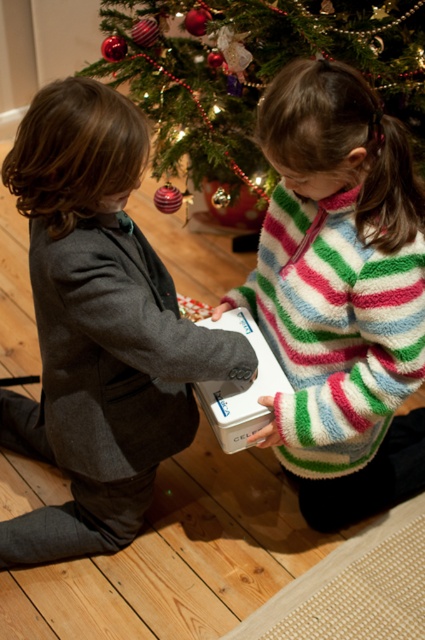
What are the coordinates of `dark gray suit at left` in the screenshot? It's located at (99, 326).

Between point (67, 198) and point (158, 145), which one is positioned behind?

Point (158, 145)

This screenshot has width=425, height=640. Identify the location of dark gray suit at left. (99, 326).

Measure the distance between white fluffy sweater at center and white matte box at center.

A distance of 7.39 inches exists between white fluffy sweater at center and white matte box at center.

Is point (325, 429) positioned behind point (255, 330)?

No, (325, 429) is closer to viewer.

This screenshot has width=425, height=640. In order to click on white fluffy sweater at center in this screenshot , I will do `click(340, 292)`.

Is white fluffy sweater at center taller than green textured christmas tree at upper center?

Indeed, white fluffy sweater at center has a greater height compared to green textured christmas tree at upper center.

Is point (393, 442) positioned in front of point (396, 29)?

No, (393, 442) is behind (396, 29).

This screenshot has height=640, width=425. I want to click on white fluffy sweater at center, so click(340, 292).